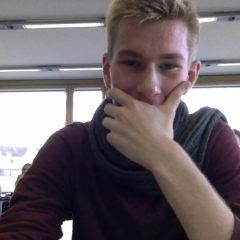
At what (x,y) coordinates should I click in order to perform the action: click on ceiling. Please return your answer as a coordinate pair (x, y). Looking at the image, I should click on (72, 50).